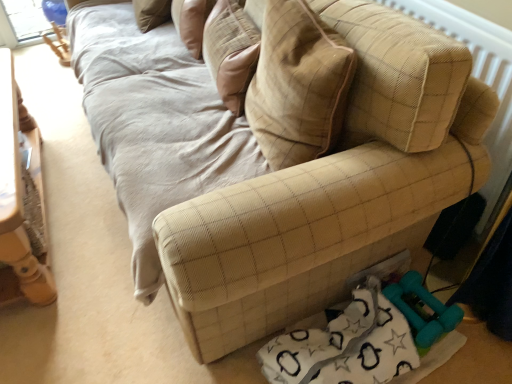
What do you see at coordinates (194, 24) in the screenshot? This screenshot has width=512, height=384. I see `beige textured pillow at upper center` at bounding box center [194, 24].

Identify the location of beige quilted pillow at center. (298, 85).

Between beige quilted pillow at center and teal rubber dumbbells at lower right, which one has larger size?

beige quilted pillow at center is bigger.

Is point (263, 46) closer or farther from the camera than point (401, 335)?

Point (263, 46) is positioned farther from the camera compared to point (401, 335).

Would you consider beige quilted pillow at center to be distant from teal rubber dumbbells at lower right?

Actually, beige quilted pillow at center and teal rubber dumbbells at lower right are a little close together.

Is beige quilted pillow at center closer to camera compared to teal rubber dumbbells at lower right?

Yes, the depth of beige quilted pillow at center is less than that of teal rubber dumbbells at lower right.

Is beige textured pillow at upper center shorter than teal rubber dumbbells at lower right?

No.

Which is more to the left, beige textured pillow at upper center or teal rubber dumbbells at lower right?

From the viewer's perspective, beige textured pillow at upper center appears more on the left side.

In the scene shown: From a real-world perspective, is beige textured pillow at upper center positioned above or below teal rubber dumbbells at lower right?

In terms of real-world spatial position, beige textured pillow at upper center is above teal rubber dumbbells at lower right.

This screenshot has height=384, width=512. Identify the location of pillow behind the teal rubber dumbbells at lower right. (194, 24).

From a real-world perspective, is beige fabric radiator at upper right below wooden table at left?

No, from a real-world perspective, beige fabric radiator at upper right is not below wooden table at left.

From the image's perspective, is beige fabric radiator at upper right located beneath wooden table at left?

No, from the image's perspective, beige fabric radiator at upper right is not below wooden table at left.

Can you confirm if beige fabric radiator at upper right is positioned to the left of wooden table at left?

Incorrect, beige fabric radiator at upper right is not on the left side of wooden table at left.

Consider the image. Does beige fabric radiator at upper right have a greater width compared to wooden table at left?

In fact, beige fabric radiator at upper right might be narrower than wooden table at left.

Measure the distance from wooden table at left to beige fabric radiator at upper right.

The distance of wooden table at left from beige fabric radiator at upper right is 5.22 feet.

Would you say wooden table at left is to the left or to the right of beige fabric radiator at upper right in the picture?

wooden table at left is positioned on beige fabric radiator at upper right's left side.

Which is correct: wooden table at left is inside beige fabric radiator at upper right, or outside of it?

wooden table at left cannot be found inside beige fabric radiator at upper right.

From a real-world perspective, who is located lower, wooden table at left or beige fabric radiator at upper right?

wooden table at left is physically lower.

Is wooden table at left facing towards teal rubber dumbbells at lower right?

No, wooden table at left is not turned towards teal rubber dumbbells at lower right.

Who is more distant, wooden table at left or teal rubber dumbbells at lower right?

wooden table at left is more distant.

Does wooden table at left appear on the right side of teal rubber dumbbells at lower right?

In fact, wooden table at left is to the left of teal rubber dumbbells at lower right.

Is beige quilted pillow at center surrounded by beige textured pillow at upper center?

No, beige quilted pillow at center is not inside beige textured pillow at upper center.

Identify the location of pillow located underneath the beige quilted pillow at center (from a real-world perspective). (194, 24).

What's the angular difference between beige textured pillow at upper center and beige quilted pillow at center's facing directions?

beige textured pillow at upper center and beige quilted pillow at center are facing 3.3 degrees away from each other.

Considering the sizes of teal rubber dumbbells at lower right and beige quilted pillow at center in the image, is teal rubber dumbbells at lower right bigger or smaller than beige quilted pillow at center?

Clearly, teal rubber dumbbells at lower right is smaller in size than beige quilted pillow at center.

Find the location of a particular element. Image resolution: width=512 pixels, height=384 pixels. material that is on the right side of beige quilted pillow at center is located at coordinates (345, 345).

Would you say teal rubber dumbbells at lower right is inside or outside beige quilted pillow at center?

teal rubber dumbbells at lower right lies outside beige quilted pillow at center.

Where is `throw pillow on the left of teal rubber dumbbells at lower right`? throw pillow on the left of teal rubber dumbbells at lower right is located at coordinates (298, 85).

Image resolution: width=512 pixels, height=384 pixels. In order to click on material below the beige textured pillow at upper center (from a real-world perspective) in this screenshot , I will do [x=345, y=345].

Based on their spatial positions, is wooden table at left or beige textured pillow at upper center further from beige fabric radiator at upper right?

wooden table at left is further to beige fabric radiator at upper right.

From the image, which object appears to be farther from beige textured pillow at upper center, beige quilted pillow at center or wooden table at left?

The object further to beige textured pillow at upper center is wooden table at left.

Based on the photo, from the image, which object appears to be farther from beige textured pillow at upper center, wooden table at left or teal rubber dumbbells at lower right?

teal rubber dumbbells at lower right is further to beige textured pillow at upper center.

Estimate the real-world distances between objects in this image. Which object is further from beige quilted pillow at center, beige fabric radiator at upper right or beige textured pillow at upper center?

Among the two, beige textured pillow at upper center is located further to beige quilted pillow at center.

From the image, which object appears to be nearer to teal rubber dumbbells at lower right, beige textured pillow at upper center or beige quilted pillow at center?

beige quilted pillow at center.

Estimate the real-world distances between objects in this image. Which object is further from wooden table at left, beige fabric radiator at upper right or beige quilted pillow at center?

The object further to wooden table at left is beige fabric radiator at upper right.

Considering their positions, is teal rubber dumbbells at lower right positioned closer to wooden table at left than beige quilted pillow at center?

The object closer to wooden table at left is beige quilted pillow at center.

Based on their spatial positions, is beige fabric radiator at upper right or beige textured pillow at upper center closer to teal rubber dumbbells at lower right?

The object closer to teal rubber dumbbells at lower right is beige fabric radiator at upper right.

The height and width of the screenshot is (384, 512). I want to click on throw pillow that lies between beige textured pillow at upper center and teal rubber dumbbells at lower right from top to bottom, so click(x=298, y=85).

Image resolution: width=512 pixels, height=384 pixels. Find the location of `radiator that lies between beige textured pillow at upper center and teal rubber dumbbells at lower right from top to bottom`. radiator that lies between beige textured pillow at upper center and teal rubber dumbbells at lower right from top to bottom is located at coordinates (478, 78).

At what (x,y) coordinates should I click in order to perform the action: click on material between wooden table at left and beige fabric radiator at upper right in the horizontal direction. Please return your answer as a coordinate pair (x, y). The width and height of the screenshot is (512, 384). Looking at the image, I should click on (345, 345).

Find the location of `throw pillow between beige fabric radiator at upper right and teal rubber dumbbells at lower right in the vertical direction`. throw pillow between beige fabric radiator at upper right and teal rubber dumbbells at lower right in the vertical direction is located at coordinates [x=298, y=85].